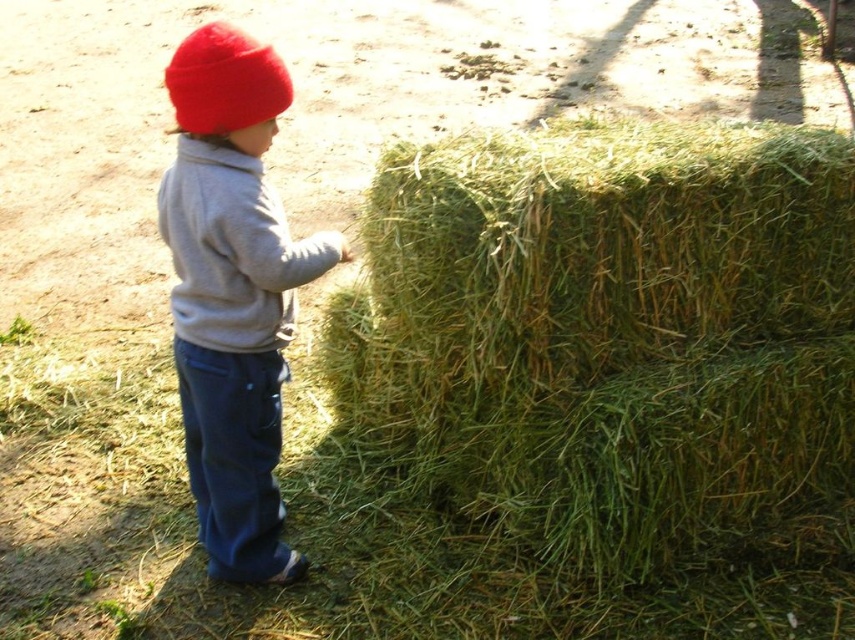
You are trying to decide which sweatshirt to wear based on the image. The matte gray sweatshirt at center and the gray fleece sweatshirt at center are both in view. Which one has a larger width?

The matte gray sweatshirt at center might be wider than the gray fleece sweatshirt at center according to the description.